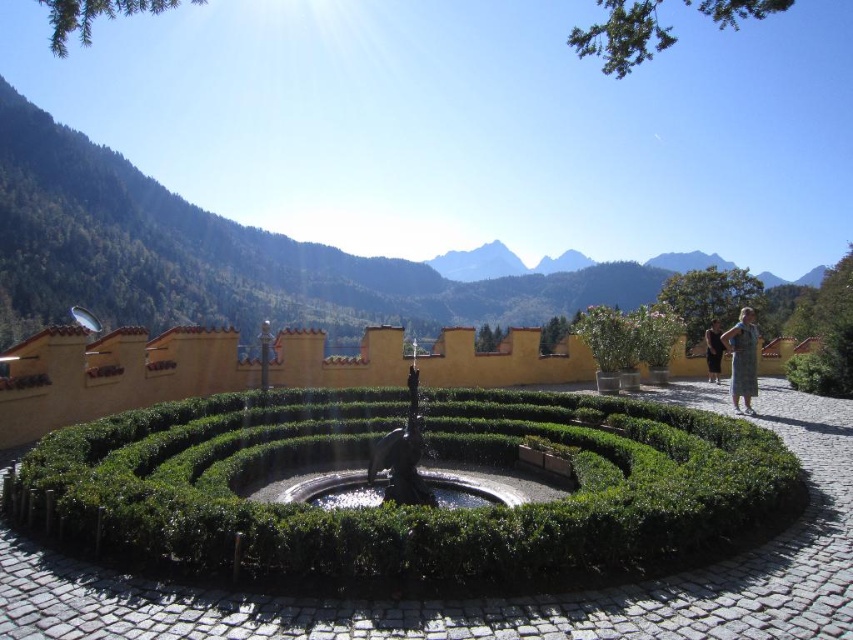
You are standing at the entrance of the hedge maze and see the bronze statue at center. If you walk straight towards the statue, will you encounter any obstacles along the path?

The bronze statue at center is positioned at coordinates point (x=399, y=472), so walking straight towards it from the entrance would require navigating the maze paths. Since the maze has walls and turns, there are obstacles along the path.

Looking at this image, you are standing in the outdoor area and want to take a photo of both the green leafy hedge at center and the bronze statue at center. Which object should you focus on first to ensure both are in clear view?

The green leafy hedge at center is closer to the viewer than the bronze statue at center, so focus on the green leafy hedge at center first to ensure both are in clear focus.

You are standing at the entrance of the hedge maze and see the point marked at coordinates (225, 257). What is the most prominent feature visible at that point in the scene?

The point at (225, 257) corresponds to the green forested mountain at upper center.